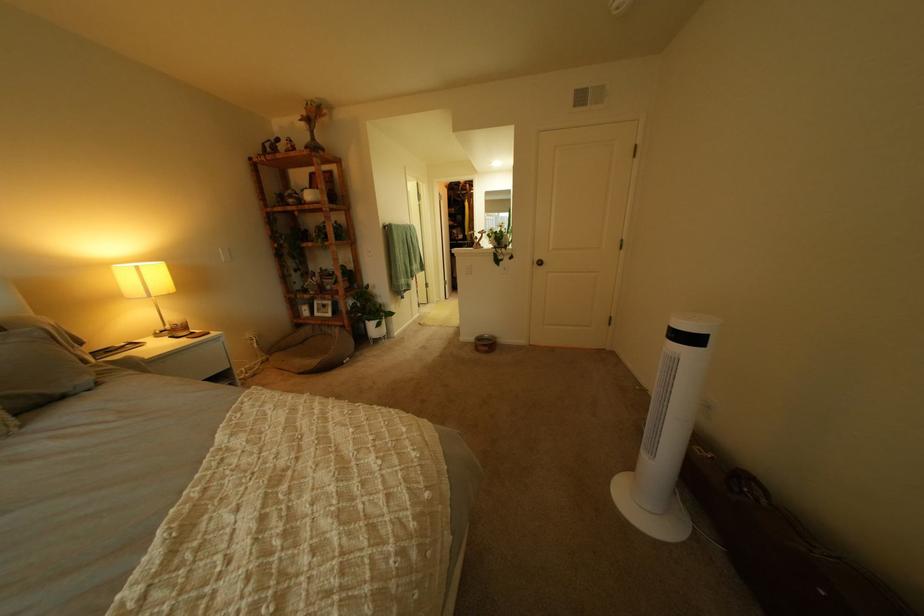
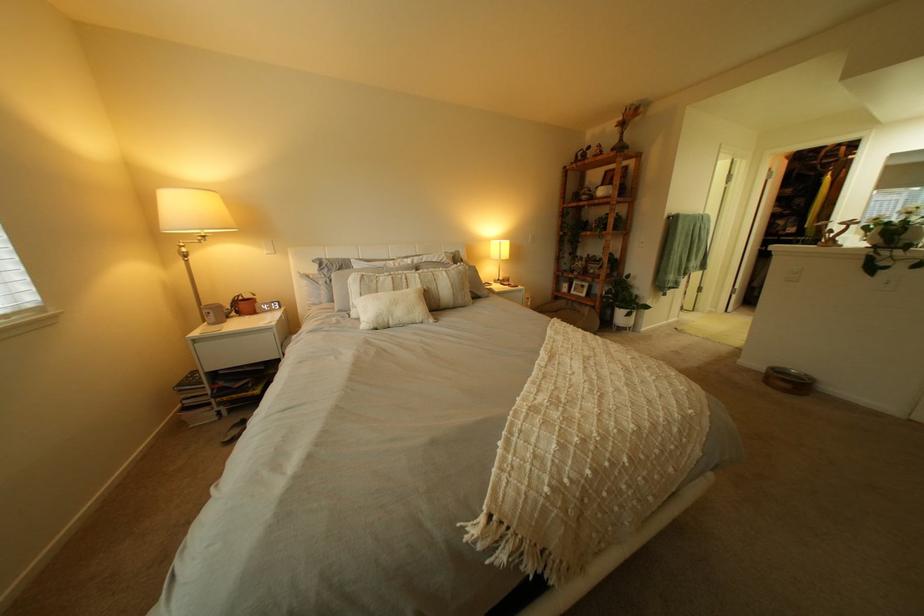
Locate, in the second image, the point that corresponds to (489,339) in the first image.

(779, 369)